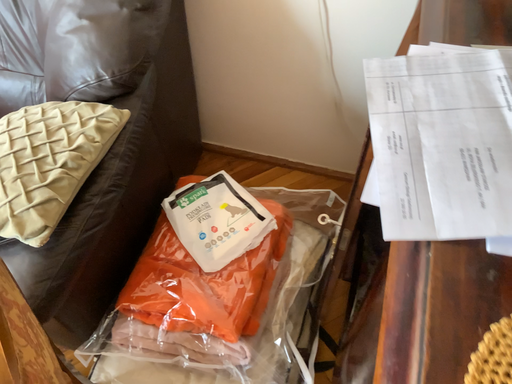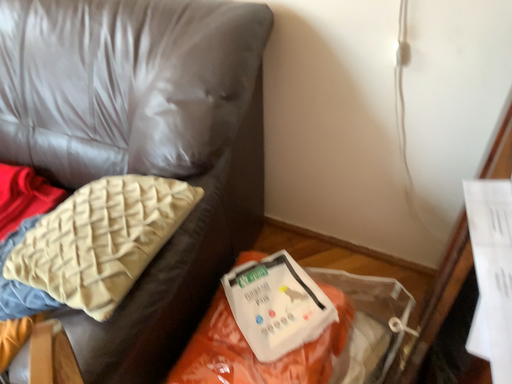
Question: Which way did the camera rotate in the video?

Choices:
 (A) rotated upward
 (B) rotated downward

Answer: (A)